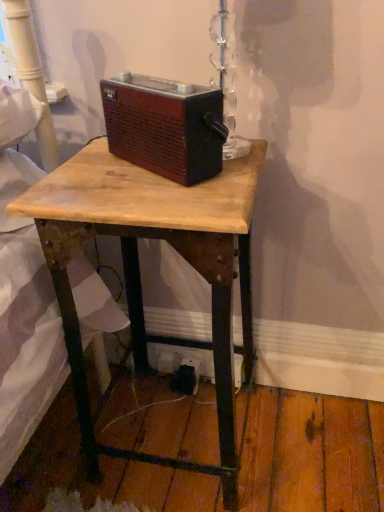
Image resolution: width=384 pixels, height=512 pixels. I want to click on vacant area situated to the left side of wooden desk at center, so click(76, 443).